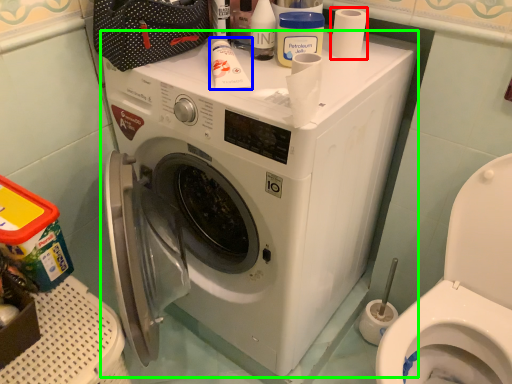
Question: Based on their relative distances, which object is farther from toilet paper (highlighted by a red box)? Choose from toiletry (highlighted by a blue box) and washing machine (highlighted by a green box).

Choices:
 (A) toiletry
 (B) washing machine

Answer: (B)